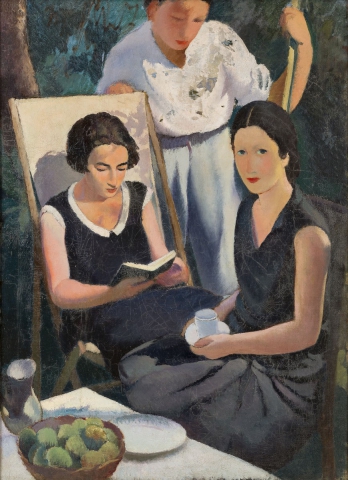
Identify the location of pitcher. (26, 398).